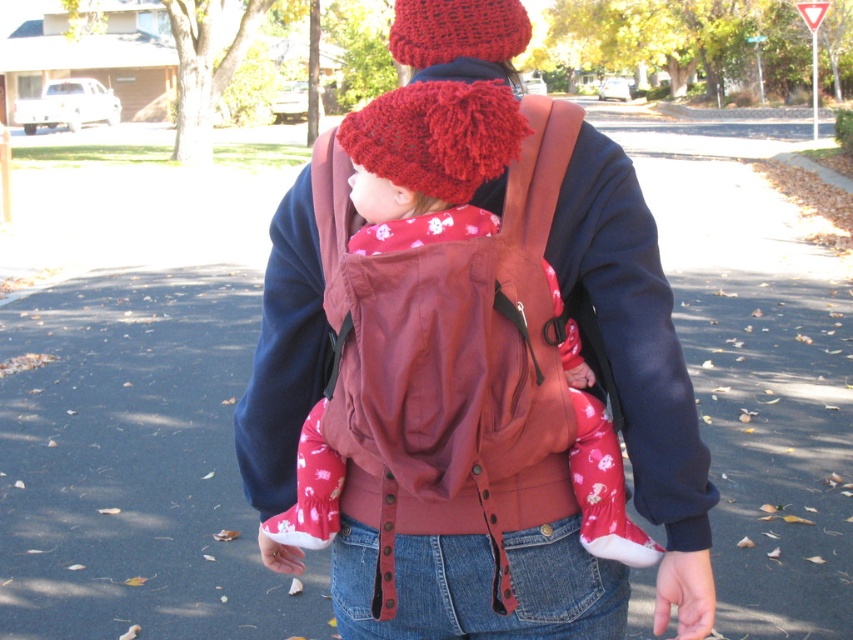
You are a photographer trying to capture a closeup of the red knitted hat at center while also including the matte brown baby carrier at center in the frame. Which object should you focus on first to ensure both are in focus?

The matte brown baby carrier at center is further to the viewer than the red knitted hat at center, so focus on the matte brown baby carrier at center first to ensure both are in focus.

You are a photographer trying to capture the scene from the right side. Which object, the matte brown baby carrier at center or the knitted woolen hat at upper center, will appear closer to the right edge of the photo?

The matte brown baby carrier at center is to the right of the knitted woolen hat at upper center, so it will appear closer to the right edge of the photo.

You are a fashion designer observing the image and want to create a new line of hats. Which hat, the red knitted hat at center or the knitted woolen hat at upper center, would require more fabric to produce a similar size?

The red knitted hat at center would require more fabric because its width is larger than the knitted woolen hat at upper center.